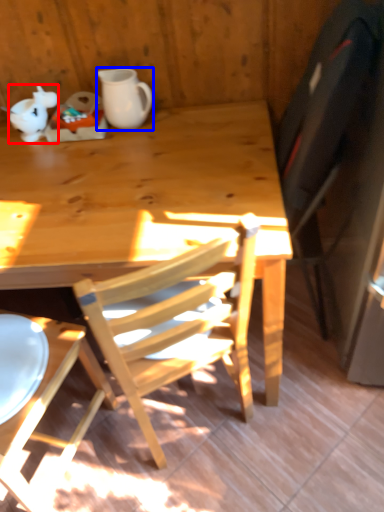
Question: Which point is closer to the camera, teapot (highlighted by a red box) or coffee cup (highlighted by a blue box)?

Choices:
 (A) teapot
 (B) coffee cup

Answer: (B)